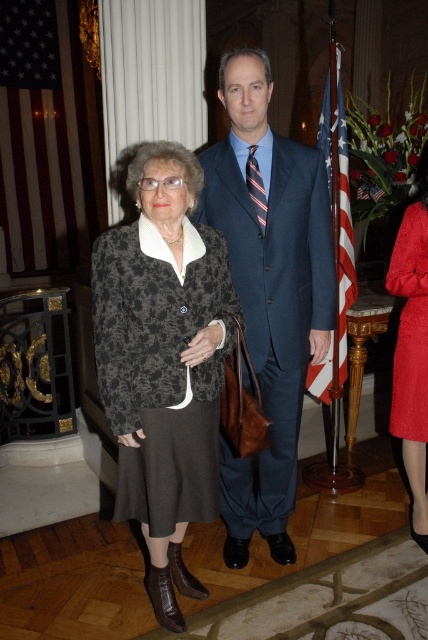
Does point (143, 477) lie in front of point (416, 220)?

Yes.

Between point (190, 170) and point (410, 228), which one is positioned behind?

The point (410, 228) is behind.

Is point (190, 504) farther from camera compared to point (419, 412)?

No, (190, 504) is in front of (419, 412).

Find the location of a particular element. The height and width of the screenshot is (640, 428). floral-patterned fabric coat at center is located at coordinates (163, 362).

Is floral-patterned fabric coat at center further to camera compared to blue suit at center?

No, it is in front of blue suit at center.

Is floral-patterned fabric coat at center bigger than blue suit at center?

Actually, floral-patterned fabric coat at center might be smaller than blue suit at center.

What do you see at coordinates (163, 362) in the screenshot? I see `floral-patterned fabric coat at center` at bounding box center [163, 362].

You are a GUI agent. You are given a task and a screenshot of the screen. Output one action in this format:
    pyautogui.click(x=<x>, y=<y>)
    Task: Click on the floral-patterned fabric coat at center
    This screenshot has width=428, height=640.
    Given the screenshot: What is the action you would take?
    pyautogui.click(x=163, y=362)

Between point (294, 456) and point (409, 371), which one is positioned behind?

Point (409, 371)

Does point (285, 467) come behind point (410, 401)?

No, it is not.

Who is more forward, (272, 353) or (413, 428)?

Point (272, 353)

Where is `blue suit at center`? blue suit at center is located at coordinates (269, 289).